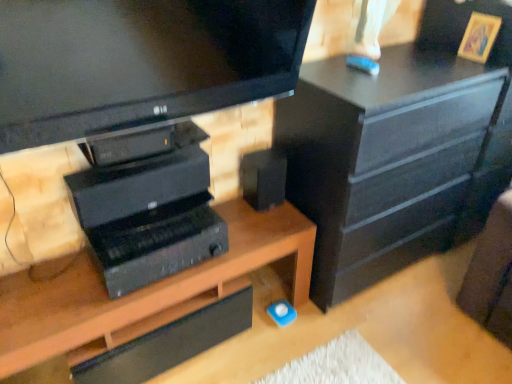
I want to click on free space to the left of black matte speaker at center, so coord(230,206).